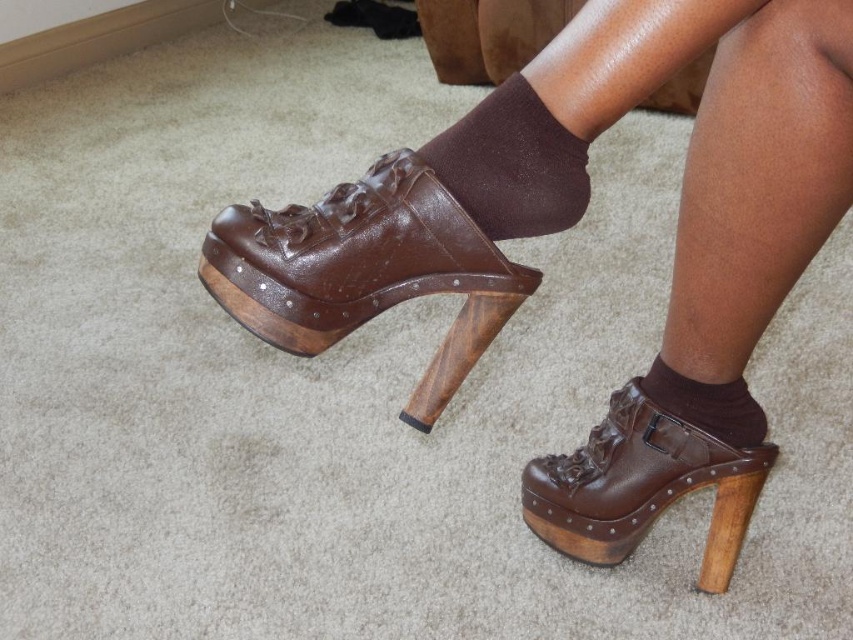
Who is positioned more to the left, brown leather clogs at center or brown woolen sock at upper center?

Positioned to the left is brown woolen sock at upper center.

The width and height of the screenshot is (853, 640). I want to click on brown leather clogs at center, so click(x=573, y=189).

At what (x,y) coordinates should I click in order to perform the action: click on brown leather clogs at center. Please return your answer as a coordinate pair (x, y). The image size is (853, 640). Looking at the image, I should click on (573, 189).

Can you confirm if brown leather clogs at center is wider than brown leather platform shoe at center?

Yes.

Which is in front, point (344, 310) or point (579, 458)?

Point (344, 310) is more forward.

Who is more distant from viewer, (616,548) or (564,493)?

The point (616,548) is behind.

You are a GUI agent. You are given a task and a screenshot of the screen. Output one action in this format:
    pyautogui.click(x=<x>, y=<y>)
    Task: Click on the brown leather clogs at center
    The width and height of the screenshot is (853, 640).
    Given the screenshot: What is the action you would take?
    pyautogui.click(x=573, y=189)

Which is more to the right, brown leather clogs at center or brown smooth sock at lower center?

From the viewer's perspective, brown smooth sock at lower center appears more on the right side.

Who is more distant from viewer, (606, 458) or (722, 429)?

The point (606, 458) is behind.

This screenshot has height=640, width=853. What do you see at coordinates (573, 189) in the screenshot?
I see `brown leather clogs at center` at bounding box center [573, 189].

Find the location of `brown leather clogs at center`. brown leather clogs at center is located at coordinates (573, 189).